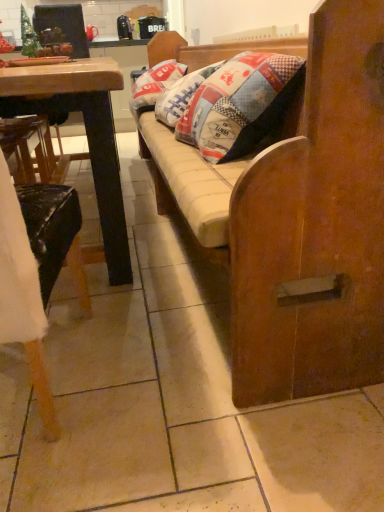
Question: Is the depth of green matte christmas tree at upper left less than that of wooden desk at left?

Choices:
 (A) no
 (B) yes

Answer: (A)

Question: Can you confirm if green matte christmas tree at upper left is bigger than wooden desk at left?

Choices:
 (A) no
 (B) yes

Answer: (A)

Question: Is green matte christmas tree at upper left not near wooden desk at left?

Choices:
 (A) yes
 (B) no

Answer: (A)

Question: Can you confirm if green matte christmas tree at upper left is taller than wooden desk at left?

Choices:
 (A) yes
 (B) no

Answer: (B)

Question: Considering the relative sizes of green matte christmas tree at upper left and wooden desk at left in the image provided, is green matte christmas tree at upper left thinner than wooden desk at left?

Choices:
 (A) no
 (B) yes

Answer: (B)

Question: From a real-world perspective, is green matte christmas tree at upper left on top of wooden desk at left?

Choices:
 (A) yes
 (B) no

Answer: (A)

Question: Is green matte christmas tree at upper left behind wooden studio couch at center?

Choices:
 (A) no
 (B) yes

Answer: (B)

Question: From the image's perspective, is green matte christmas tree at upper left beneath wooden studio couch at center?

Choices:
 (A) yes
 (B) no

Answer: (B)

Question: Does green matte christmas tree at upper left have a greater height compared to wooden studio couch at center?

Choices:
 (A) yes
 (B) no

Answer: (B)

Question: Does green matte christmas tree at upper left lie in front of wooden studio couch at center?

Choices:
 (A) no
 (B) yes

Answer: (A)

Question: Are green matte christmas tree at upper left and wooden studio couch at center beside each other?

Choices:
 (A) no
 (B) yes

Answer: (A)

Question: Does green matte christmas tree at upper left turn towards wooden studio couch at center?

Choices:
 (A) yes
 (B) no

Answer: (B)

Question: Is wooden chair at left taller than wooden studio couch at center?

Choices:
 (A) yes
 (B) no

Answer: (B)